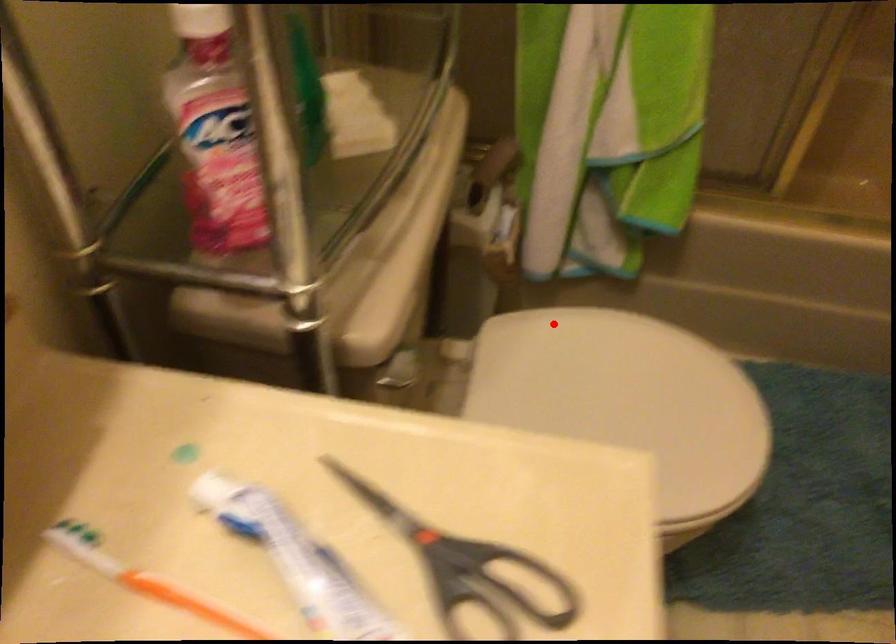
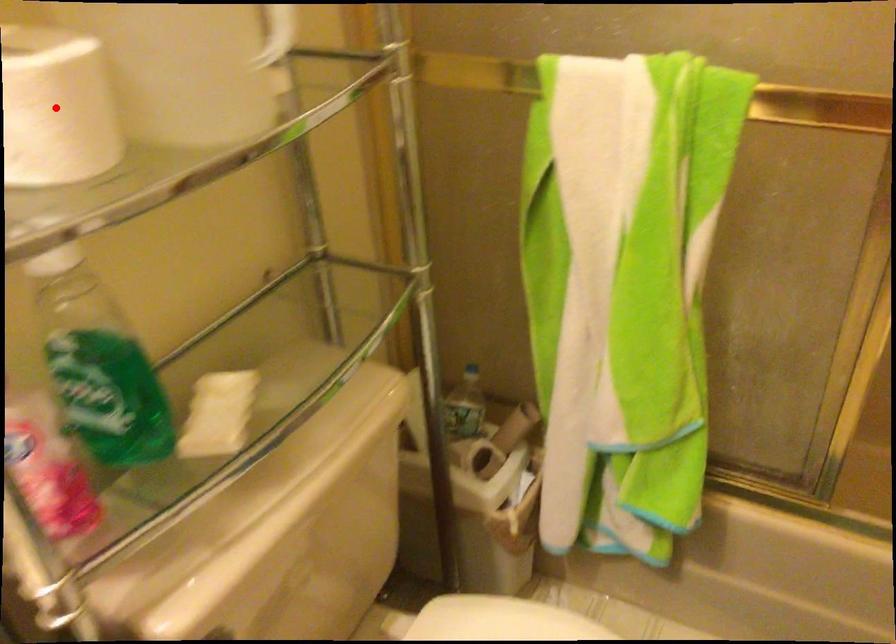
I am providing you with two images of the same scene from different viewpoints. A red point is marked on the first image and another point is marked on the second image. Do the highlighted points in image1 and image2 indicate the same real-world spot?

No